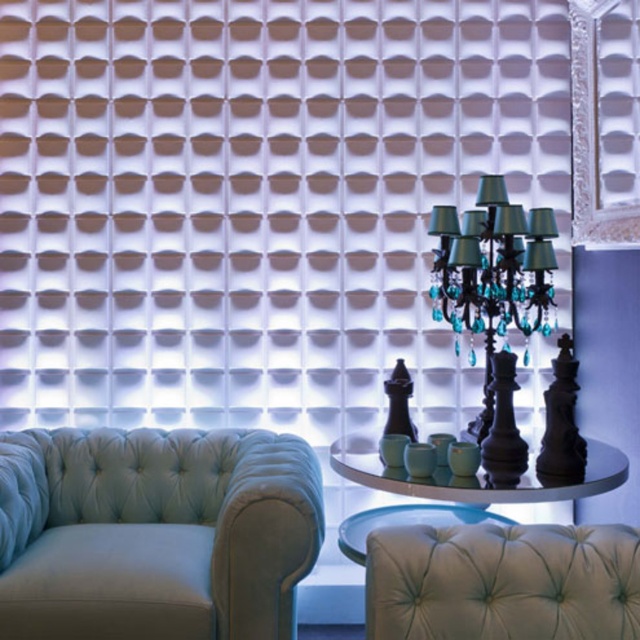
You are standing in the room and want to place a new decorative item between the tufted leather armchair at center and the shiny black chess set at center. Based on their positions, which side of the chess set should you place it on?

The tufted leather armchair at center is to the left of the shiny black chess set at center, so you should place the new decorative item to the right side of the chess set.

You are a delivery person who needs to place a large package on the surface between the light blue velvet couch at lower left and the shiny black chess set at center. Can the package be placed there without touching the couch?

The light blue velvet couch at lower left is taller than the shiny black chess set at center. Since the couch is taller, the space between them might be limited in height. However, the question is about placing the package on the surface between them, which likely refers to the horizontal space. The height difference doesn not directly affect the horizontal placement. Therefore, the package can be placed there as long as the surface is clear and the chess set doesn not block the area.